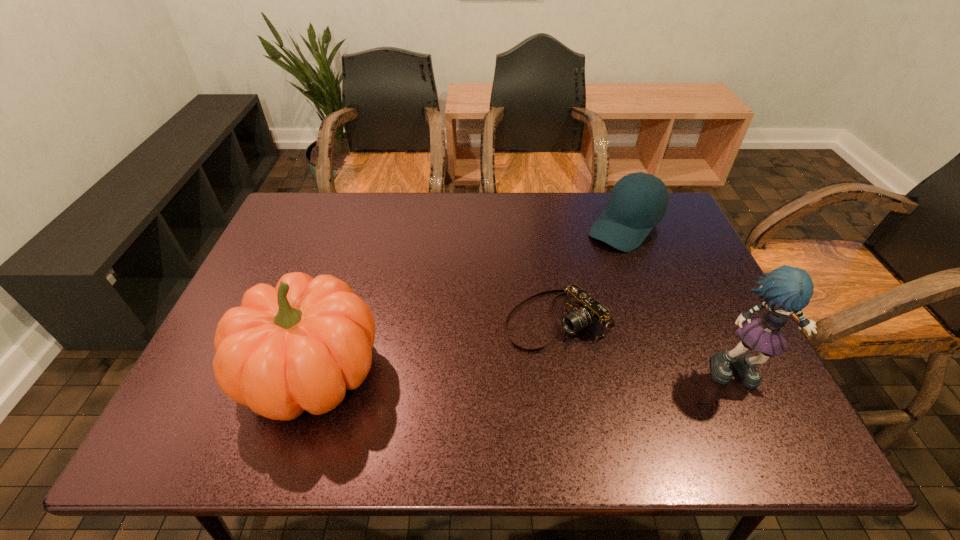
Locate an element on the screen. The height and width of the screenshot is (540, 960). vacant region between the rag doll and the leftmost object is located at coordinates (526, 373).

Locate an element on the screen. The image size is (960, 540). vacant space that's between the shortest object and the rag doll is located at coordinates (650, 346).

You are a GUI agent. You are given a task and a screenshot of the screen. Output one action in this format:
    pyautogui.click(x=<x>, y=<y>)
    Task: Click on the vacant area that lies between the shortest object and the rag doll
    Image resolution: width=960 pixels, height=540 pixels.
    Given the screenshot: What is the action you would take?
    pyautogui.click(x=650, y=346)

Identify the location of free point between the third tallest object and the shortest object. (591, 273).

Where is `empty space between the pumpkin and the baseball cap`? The width and height of the screenshot is (960, 540). empty space between the pumpkin and the baseball cap is located at coordinates (468, 300).

Locate an element on the screen. The width and height of the screenshot is (960, 540). free spot between the farthest object and the rag doll is located at coordinates (684, 299).

Locate which object ranks in proximity to the second shortest object. Please provide its 2D coordinates. Your answer should be formatted as a tuple, i.e. [(x, y)], where the tuple contains the x and y coordinates of a point satisfying the conditions above.

[(584, 311)]

Point out which object is positioned as the second nearest to the shortest object. Please provide its 2D coordinates. Your answer should be formatted as a tuple, i.e. [(x, y)], where the tuple contains the x and y coordinates of a point satisfying the conditions above.

[(786, 290)]